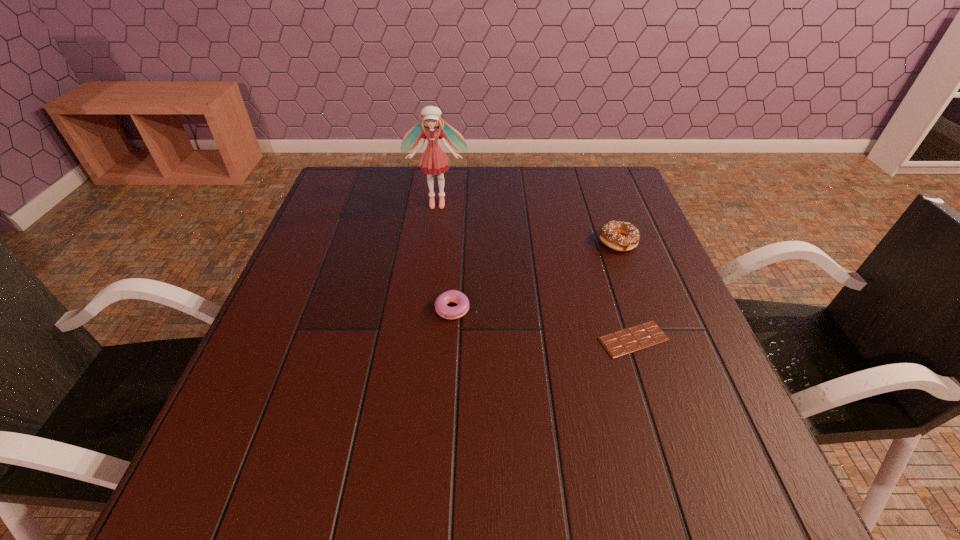
Find the location of a particular element. The height and width of the screenshot is (540, 960). doll is located at coordinates (434, 160).

You are a GUI agent. You are given a task and a screenshot of the screen. Output one action in this format:
    pyautogui.click(x=<x>, y=<y>)
    Task: Click on the farthest object
    This screenshot has width=960, height=540.
    Given the screenshot: What is the action you would take?
    pyautogui.click(x=434, y=160)

The width and height of the screenshot is (960, 540). Find the location of `the taller doughnut`. the taller doughnut is located at coordinates (621, 236).

In order to click on the right doughnut in this screenshot , I will do `click(621, 236)`.

Image resolution: width=960 pixels, height=540 pixels. Find the location of `the shorter doughnut`. the shorter doughnut is located at coordinates (452, 296).

Where is `the nearer doughnut`? The image size is (960, 540). the nearer doughnut is located at coordinates coord(452,296).

At what (x,y) coordinates should I click in order to perform the action: click on chocolate bar. Please return your answer as a coordinate pair (x, y). This screenshot has height=540, width=960. Looking at the image, I should click on (619, 343).

Find the location of a particular element. free location located on the front-facing side of the doll is located at coordinates coord(428,275).

What are the coordinates of `free space located 0.340m on the back of the third nearest object` in the screenshot? It's located at (590, 167).

Locate an element on the screen. Image resolution: width=960 pixels, height=540 pixels. free space located on the right of the second shortest object is located at coordinates (544, 309).